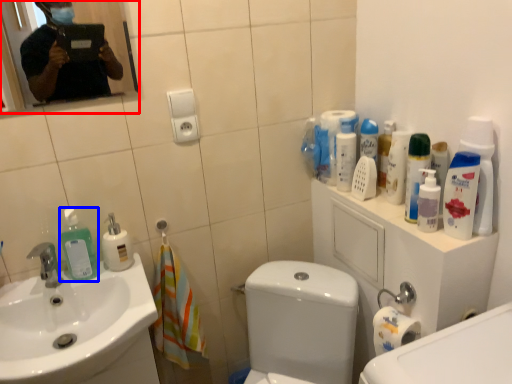
Question: Which point is closer to the camera, mirror (highlighted by a red box) or cleaning product (highlighted by a blue box)?

Choices:
 (A) mirror
 (B) cleaning product

Answer: (A)